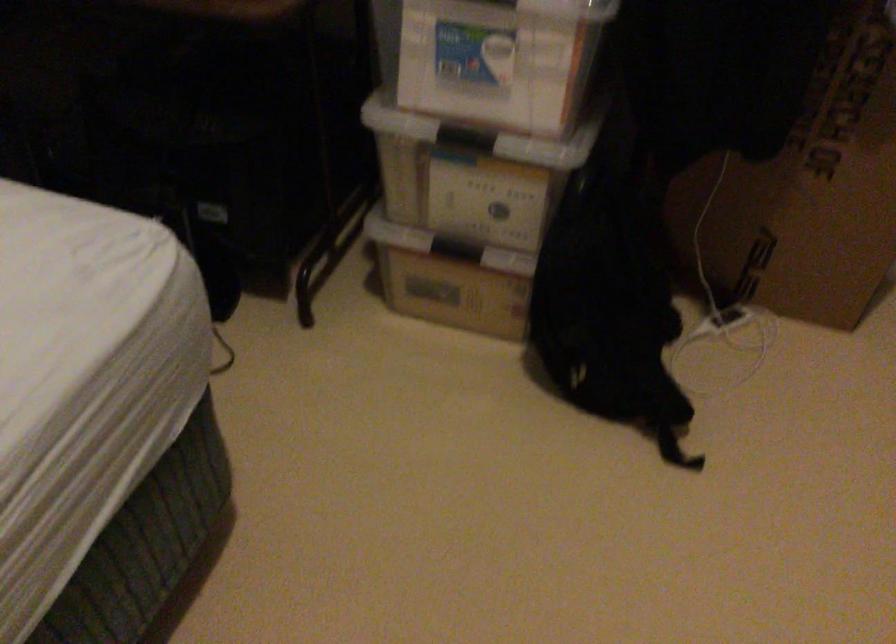
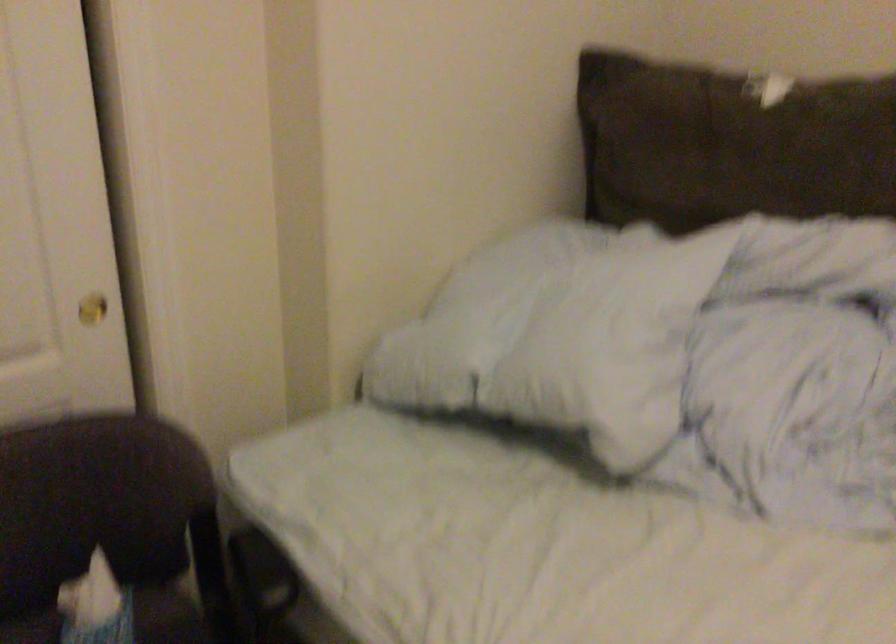
The images are taken continuously from a first-person perspective. In which direction is your viewpoint rotating?

The rotation direction of the camera is left-down.